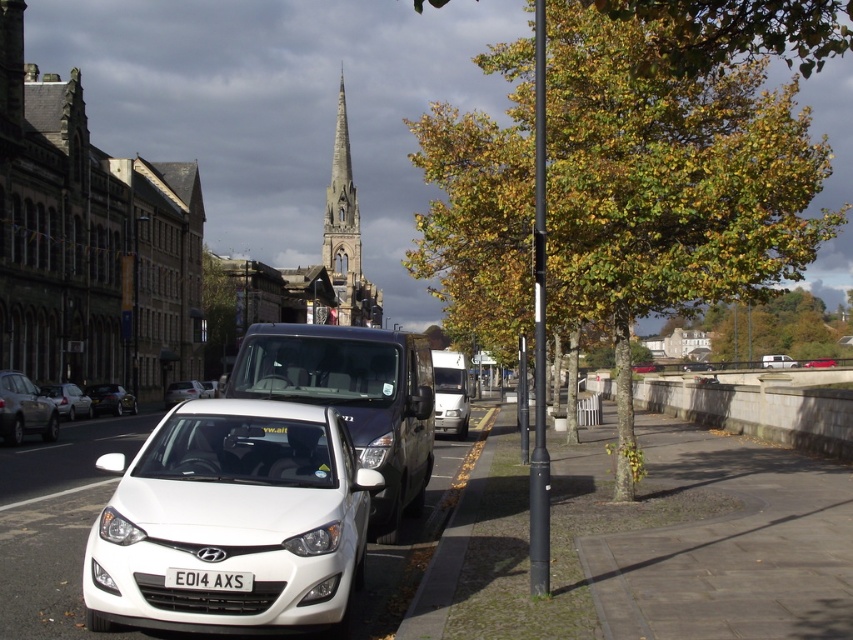
Question: Which of the following is the closest to the observer?

Choices:
 (A) (345, 289)
 (B) (418, 612)
 (C) (270, 538)
 (D) (701, 326)

Answer: (C)

Question: Can you confirm if silver metallic hatchback at center-left is positioned above metallic silver van at center?

Choices:
 (A) no
 (B) yes

Answer: (A)

Question: Which point is closer to the camera?

Choices:
 (A) (50, 387)
 (B) (239, 588)

Answer: (B)

Question: Which object is positioned closest to the brown concrete curb at lower center?

Choices:
 (A) stone steeple at center
 (B) white matte hatchback at center
 (C) matte silver car at left
 (D) glossy metallic van at center

Answer: (D)

Question: In this image, where is brown concrete curb at lower center located relative to white plastic license plate at center?

Choices:
 (A) right
 (B) left

Answer: (A)

Question: Can you confirm if white glossy hatchback at lower left is wider than white matte hatchback at center-left?

Choices:
 (A) yes
 (B) no

Answer: (B)